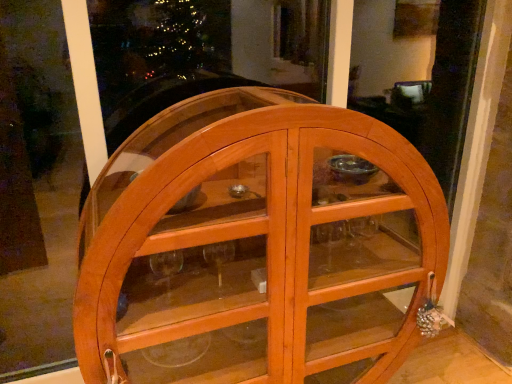
This screenshot has height=384, width=512. What do you see at coordinates (254, 246) in the screenshot?
I see `wooden cabinet at center` at bounding box center [254, 246].

The height and width of the screenshot is (384, 512). I want to click on wooden cabinet at center, so click(254, 246).

You are a GUI agent. You are given a task and a screenshot of the screen. Output one action in this format:
    pyautogui.click(x=<x>, y=<y>)
    Task: Click on the wooden cabinet at center
    Image resolution: width=512 pixels, height=384 pixels.
    Given the screenshot: What is the action you would take?
    pyautogui.click(x=254, y=246)